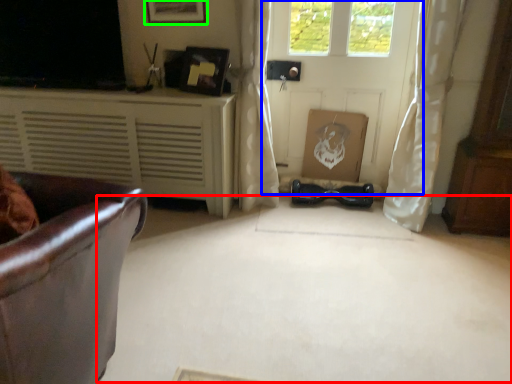
Question: Which object is positioned closest to plain (highlighted by a red box)? Select from door (highlighted by a blue box) and picture frame (highlighted by a green box).

Choices:
 (A) door
 (B) picture frame

Answer: (A)